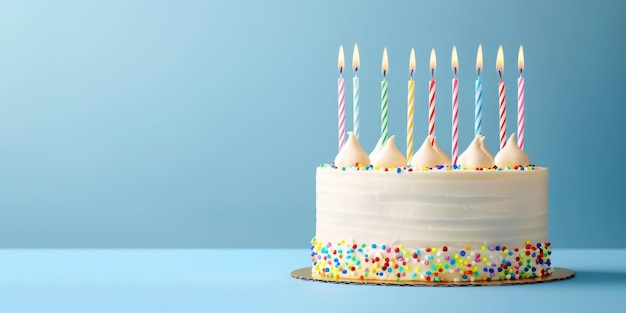
This screenshot has width=626, height=313. I want to click on birthday candles, so click(x=340, y=97), click(x=357, y=100), click(x=382, y=119), click(x=411, y=116), click(x=433, y=114), click(x=454, y=126), click(x=481, y=112), click(x=504, y=111), click(x=521, y=113).